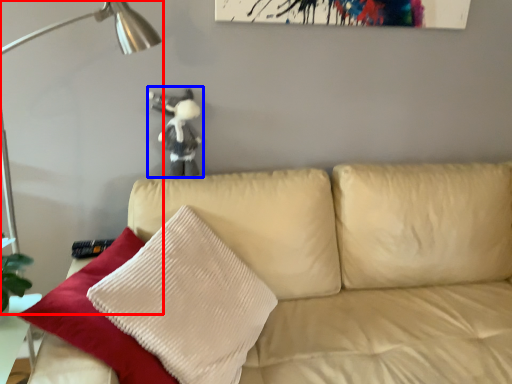
Question: Which object is further to the camera taking this photo, table lamp (highlighted by a red box) or figurine (highlighted by a blue box)?

Choices:
 (A) table lamp
 (B) figurine

Answer: (B)